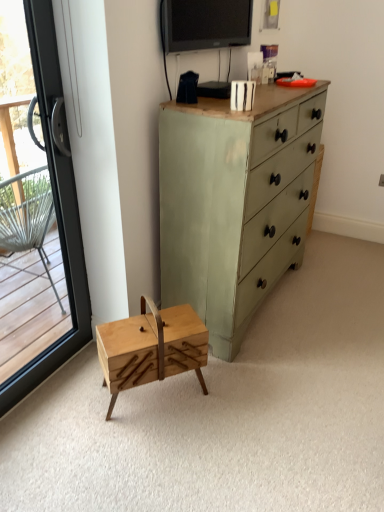
Locate an element on the screen. The width and height of the screenshot is (384, 512). vacant area in front of natural wood sewing box at center is located at coordinates (154, 448).